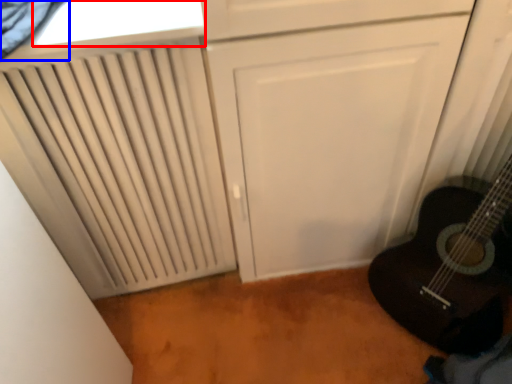
Question: Which object is closer to the camera taking this photo, window (highlighted by a red box) or curtain (highlighted by a blue box)?

Choices:
 (A) window
 (B) curtain

Answer: (B)